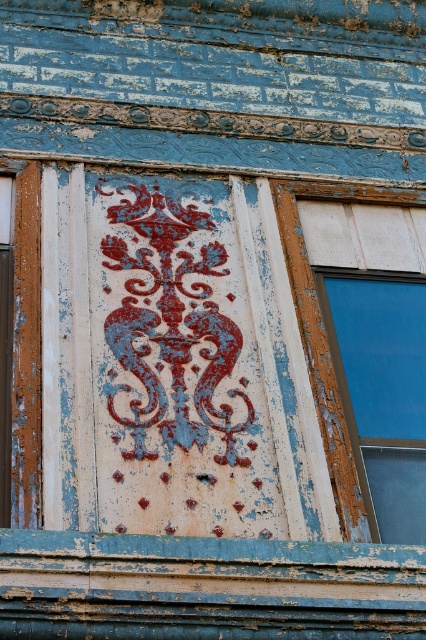
You are an art conservator examining the old building facade. You notice the rusty metal octopus at center and the blue glass window at right. Which object is placed above the other?

The rusty metal octopus at center is positioned over the blue glass window at right, meaning it is above it.